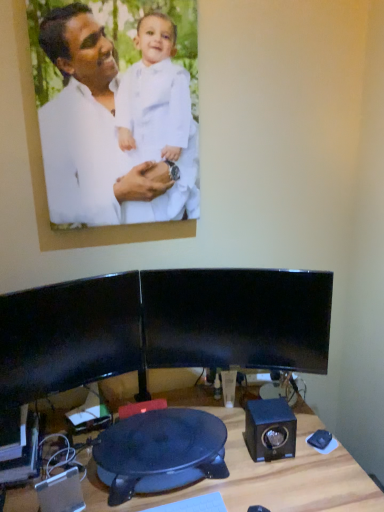
Identify the location of vacant location behind black plastic keyboard at lower center. The image size is (384, 512). (186, 488).